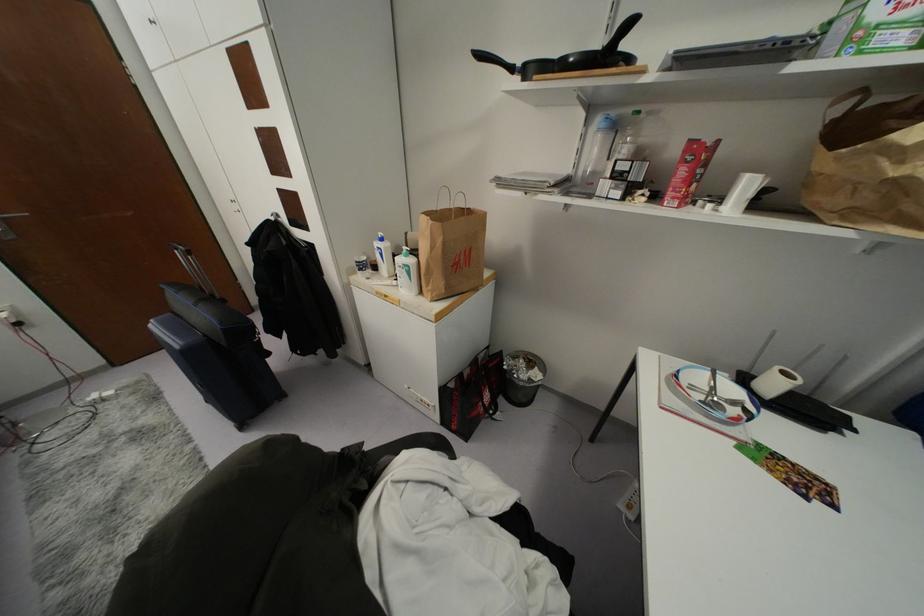
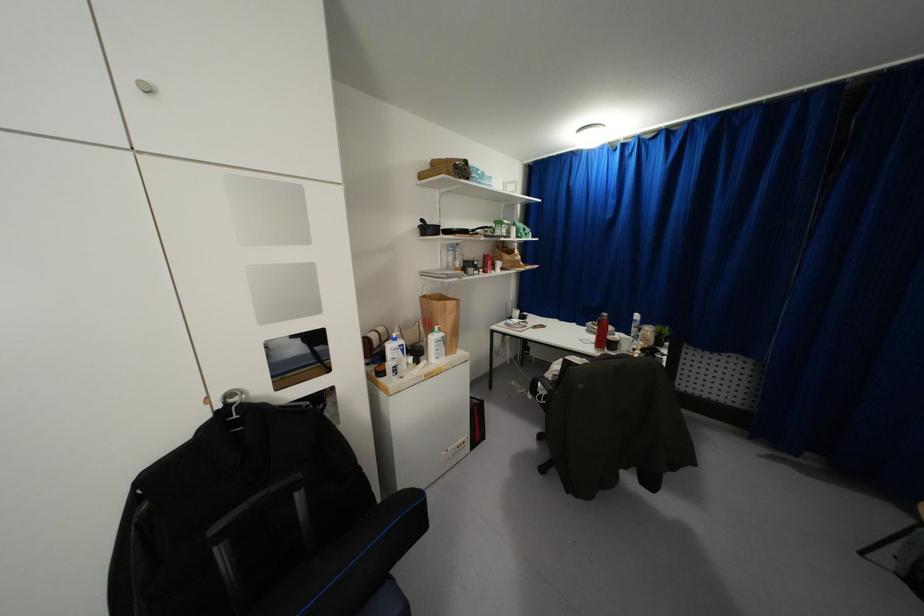
Find the pixel in the second image that matches (599,130) in the first image.

(446, 249)